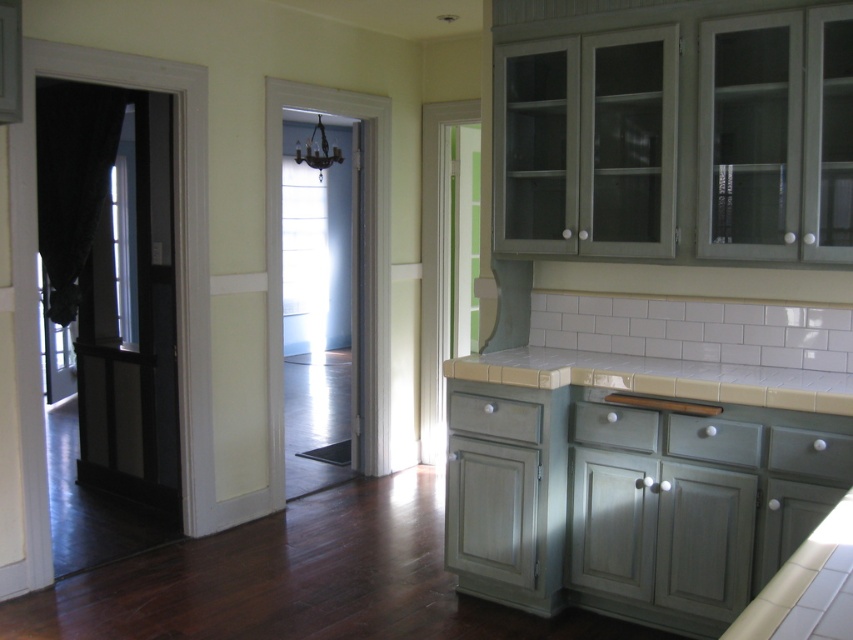
Question: Does white tile countertop at center have a smaller size compared to beige tile countertop at center?

Choices:
 (A) no
 (B) yes

Answer: (A)

Question: Is white tile countertop at center below beige tile countertop at center?

Choices:
 (A) yes
 (B) no

Answer: (A)

Question: Which of the following is the farthest from the observer?

Choices:
 (A) (471, 358)
 (B) (492, 401)

Answer: (A)

Question: Does white tile countertop at center appear under beige tile countertop at center?

Choices:
 (A) no
 (B) yes

Answer: (B)

Question: Which object appears farthest from the camera in this image?

Choices:
 (A) white tile countertop at center
 (B) beige tile countertop at center

Answer: (A)